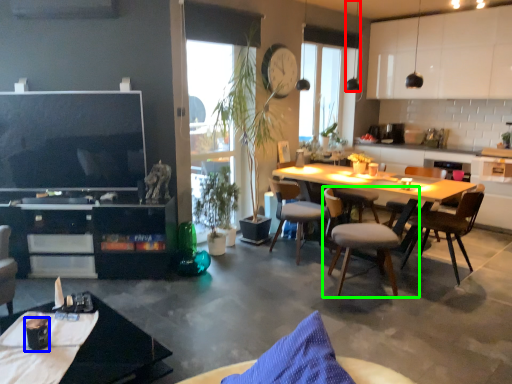
Question: Which object is positioned closest to lamp (highlighted by a red box)? Select from coffee cup (highlighted by a blue box) and chair (highlighted by a green box).

Choices:
 (A) coffee cup
 (B) chair

Answer: (B)